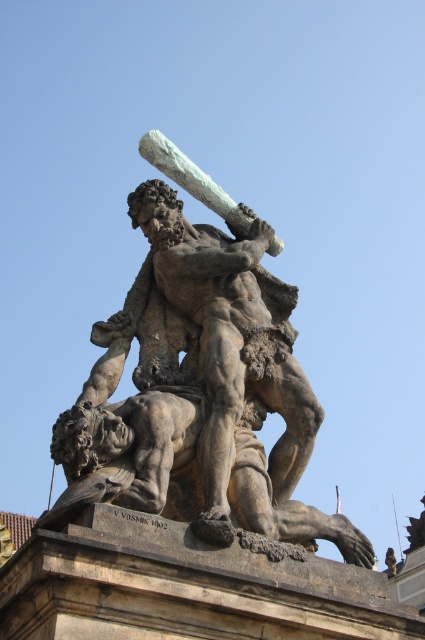
Question: In this image, where is matte stone sculpture at center located relative to rough stone statue at center?

Choices:
 (A) left
 (B) right

Answer: (B)

Question: Which point is farther to the camera?

Choices:
 (A) matte stone sculpture at center
 (B) rough stone statue at center

Answer: (B)

Question: Which point is closer to the camera?

Choices:
 (A) matte stone sculpture at center
 (B) rough stone statue at center

Answer: (A)

Question: Is matte stone sculpture at center thinner than rough stone statue at center?

Choices:
 (A) no
 (B) yes

Answer: (A)

Question: Which point is farther to the camera?

Choices:
 (A) rough stone statue at center
 (B) matte stone sculpture at center

Answer: (A)

Question: Is matte stone sculpture at center bigger than rough stone statue at center?

Choices:
 (A) no
 (B) yes

Answer: (B)